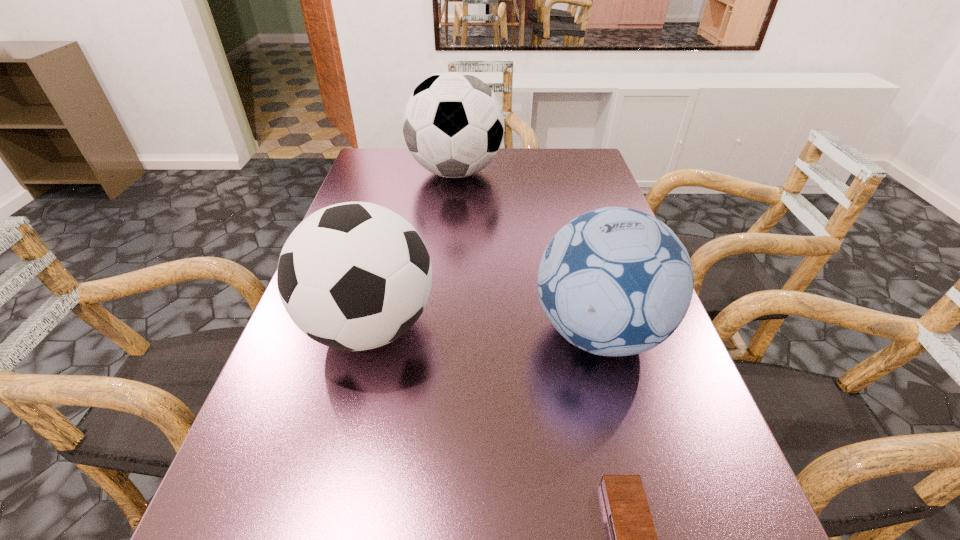
Find the location of a particular element. This screenshot has width=960, height=540. the farthest soccer ball is located at coordinates (453, 125).

In order to click on the rightmost soccer ball in this screenshot , I will do `click(615, 281)`.

Locate an element on the screen. This screenshot has height=540, width=960. vacant space located 0.130m on the main logo of the farthest soccer ball is located at coordinates (545, 173).

Where is `free spot located 0.280m on the side with brand of the rightmost soccer ball`? The image size is (960, 540). free spot located 0.280m on the side with brand of the rightmost soccer ball is located at coordinates (389, 332).

Locate an element on the screen. This screenshot has height=540, width=960. vacant space located on the side with brand of the rightmost soccer ball is located at coordinates [x=440, y=332].

This screenshot has width=960, height=540. I want to click on vacant space located 0.350m on the side with brand of the rightmost soccer ball, so click(352, 332).

This screenshot has height=540, width=960. I want to click on object situated at the far edge, so click(453, 125).

Find the location of a particular element. This screenshot has height=540, width=960. object that is at the right edge is located at coordinates (615, 281).

Identify the location of object that is at the far left corner. point(453,125).

The height and width of the screenshot is (540, 960). In order to click on free location at the far edge of the desktop in this screenshot , I will do `click(457, 180)`.